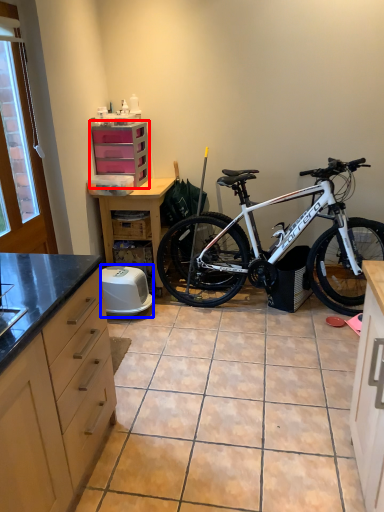
Question: Which of the following is the farthest to the observer, chest of drawers (highlighted by a red box) or appliance (highlighted by a blue box)?

Choices:
 (A) chest of drawers
 (B) appliance

Answer: (A)